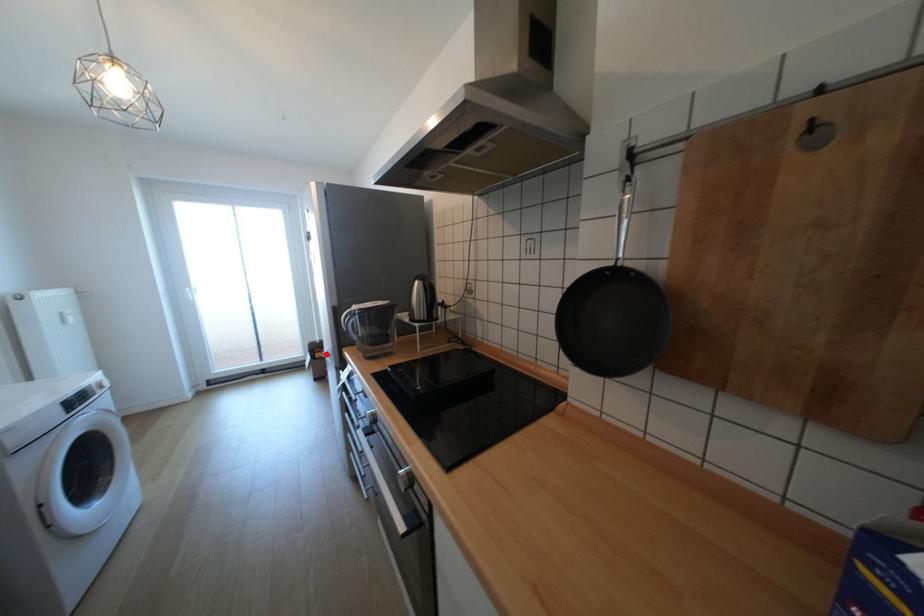
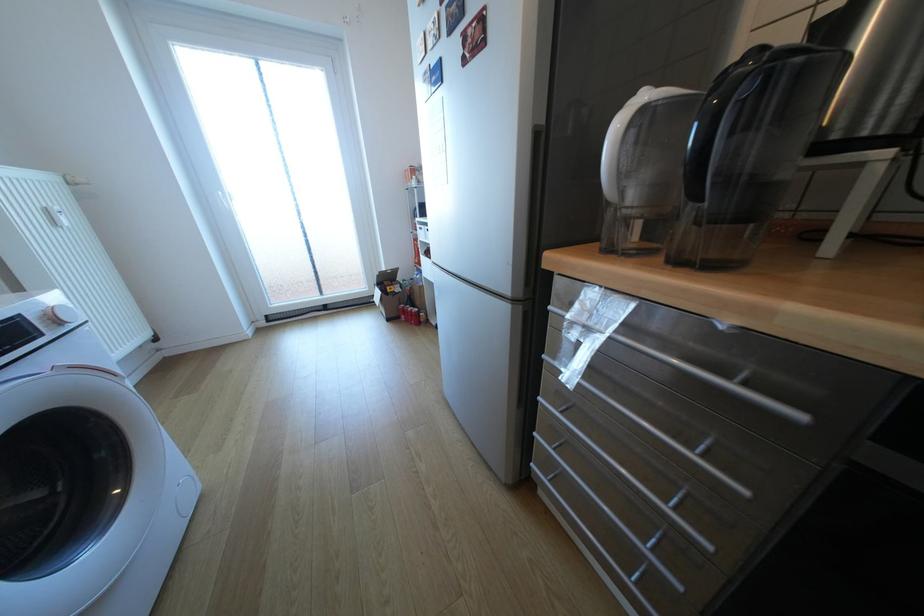
The point at the highlighted location is marked in the first image. Where is the corresponding point in the second image?

(397, 288)